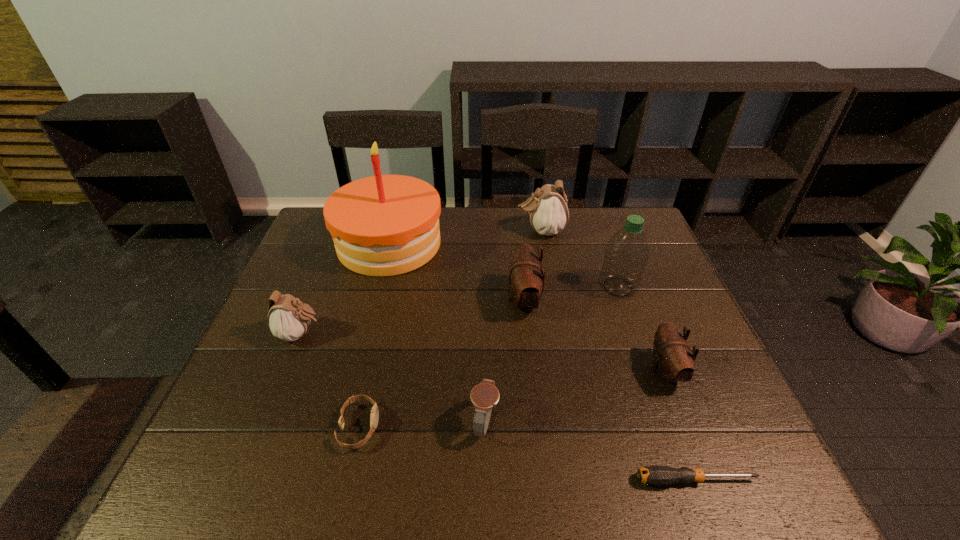
At what (x,y) coordinates should I click in order to perform the action: click on blank space located 0.390m on the back of the gray watch. Please return your answer as a coordinate pair (x, y). The width and height of the screenshot is (960, 540). Looking at the image, I should click on (484, 282).

Locate an element on the screen. free space located 0.130m on the face of the shorter watch is located at coordinates (440, 427).

At what (x,y) coordinates should I click in order to perform the action: click on free space located 0.140m on the left of the nearest object. Please return your answer as a coordinate pair (x, y). Image resolution: width=960 pixels, height=540 pixels. Looking at the image, I should click on (563, 480).

Image resolution: width=960 pixels, height=540 pixels. What are the coordinates of `birthday cake that is positioned at the far edge` in the screenshot? It's located at (384, 225).

Locate an element on the screen. This screenshot has width=960, height=540. pouch present at the far edge is located at coordinates (548, 210).

You are a GUI agent. You are given a task and a screenshot of the screen. Output one action in this format:
    pyautogui.click(x=<x>, y=<y>)
    Task: Click on the screwdriver present at the near edge
    This screenshot has width=960, height=540.
    Given the screenshot: What is the action you would take?
    pyautogui.click(x=651, y=475)

This screenshot has width=960, height=540. Find the location of `birthday cake situated at the left edge`. birthday cake situated at the left edge is located at coordinates (384, 225).

This screenshot has width=960, height=540. Find the location of `pouch that is positioned at the left edge`. pouch that is positioned at the left edge is located at coordinates (288, 318).

Identify the location of water bottle located at the right edge. The image size is (960, 540). (626, 254).

Find the location of a particular element. This screenshot has width=960, height=540. pouch that is positioned at the right edge is located at coordinates (673, 361).